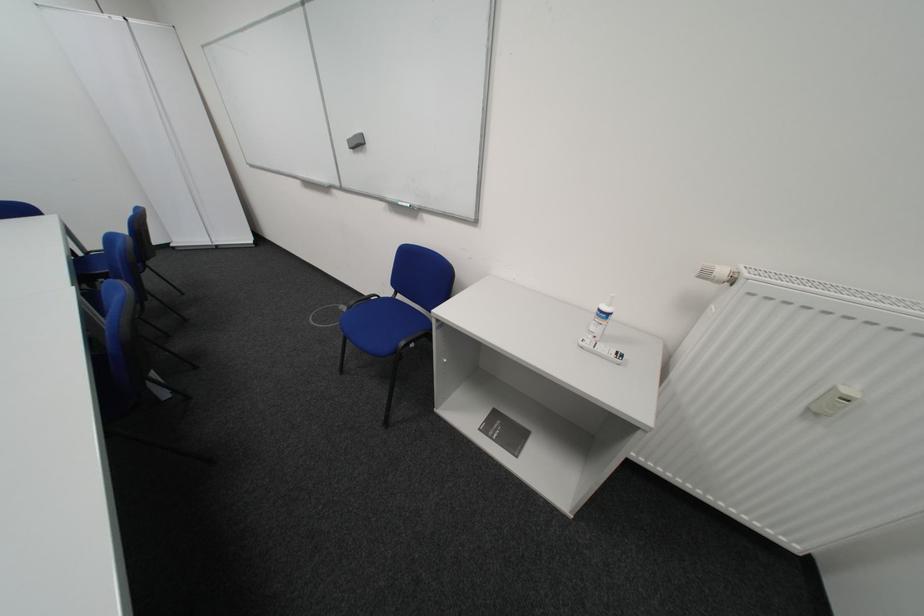
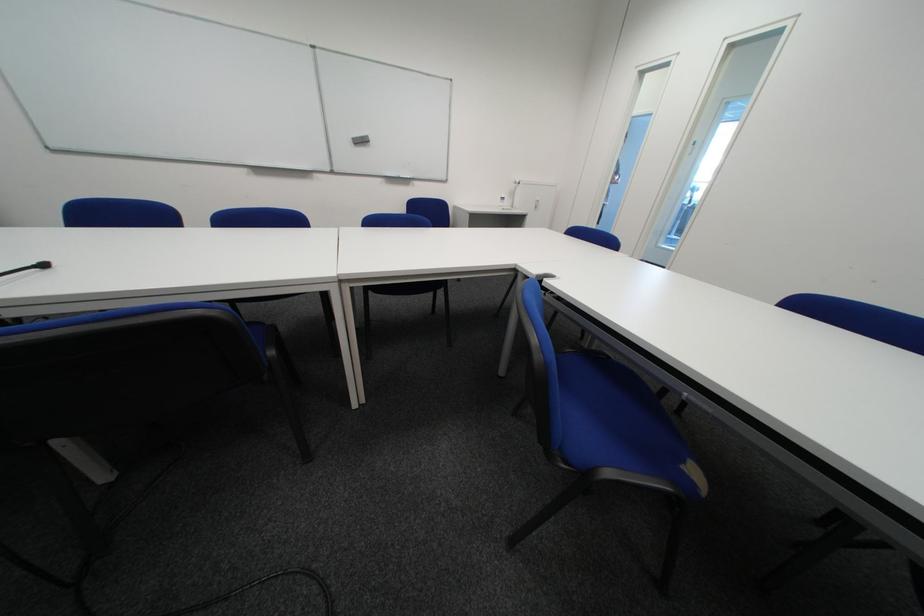
Question: I am providing you with two images of the same scene from different viewpoints. After the viewpoint changes to image2, which objects are now occluded?

Choices:
 (A) red and black shoe
 (B) black microphone
 (C) small white bottle
 (D) blue chair sitting surface

Answer: (D)